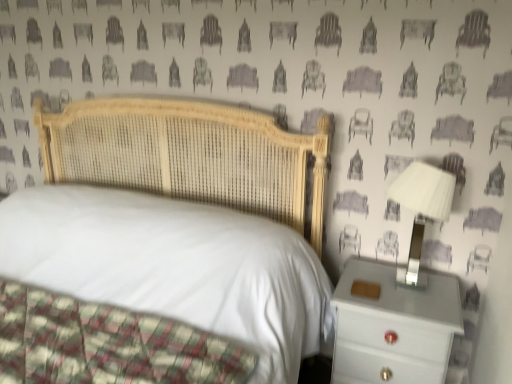
The width and height of the screenshot is (512, 384). I want to click on free space above white glossy nightstand at right (from a real-world perspective), so click(x=407, y=292).